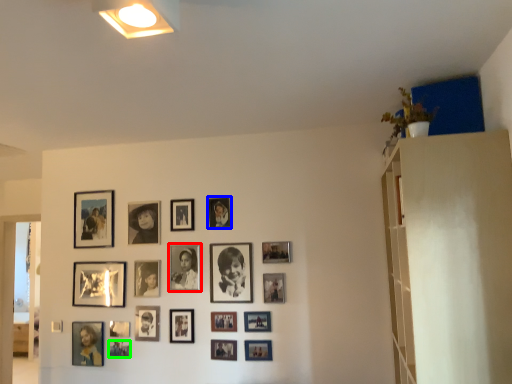
Question: Estimate the real-world distances between objects in this image. Which object is closer to picture frame (highlighted by a red box), picture frame (highlighted by a blue box) or picture frame (highlighted by a green box)?

Choices:
 (A) picture frame
 (B) picture frame

Answer: (A)